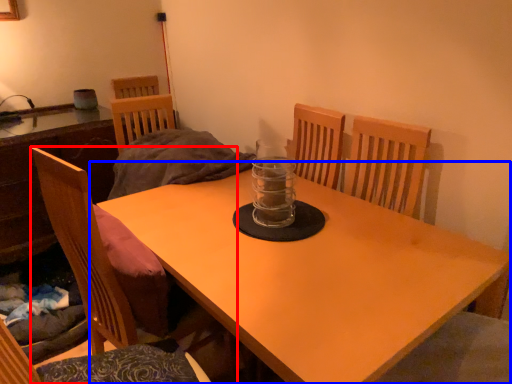
Question: Which object is further to the camera taking this photo, chair (highlighted by a red box) or table (highlighted by a blue box)?

Choices:
 (A) chair
 (B) table

Answer: (B)